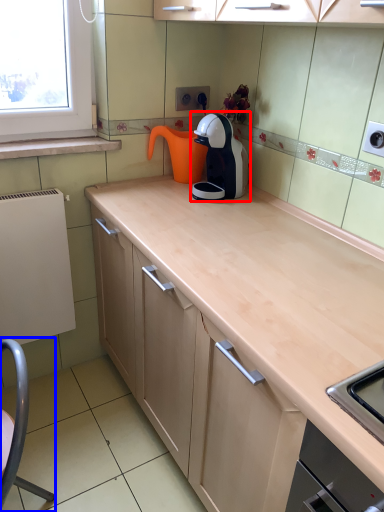
Question: Among these objects, which one is farthest to the camera, kitchen appliance (highlighted by a red box) or swivel chair (highlighted by a blue box)?

Choices:
 (A) kitchen appliance
 (B) swivel chair

Answer: (A)